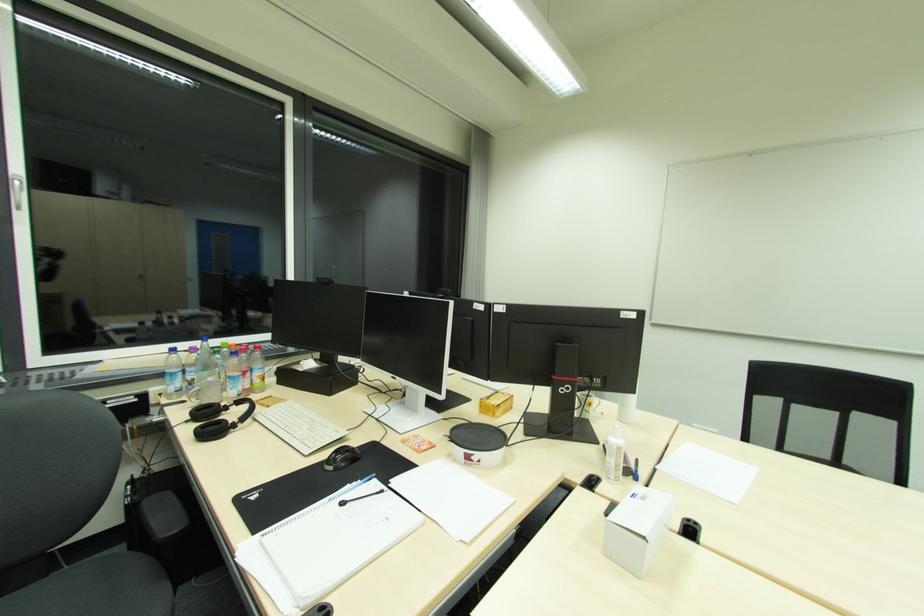
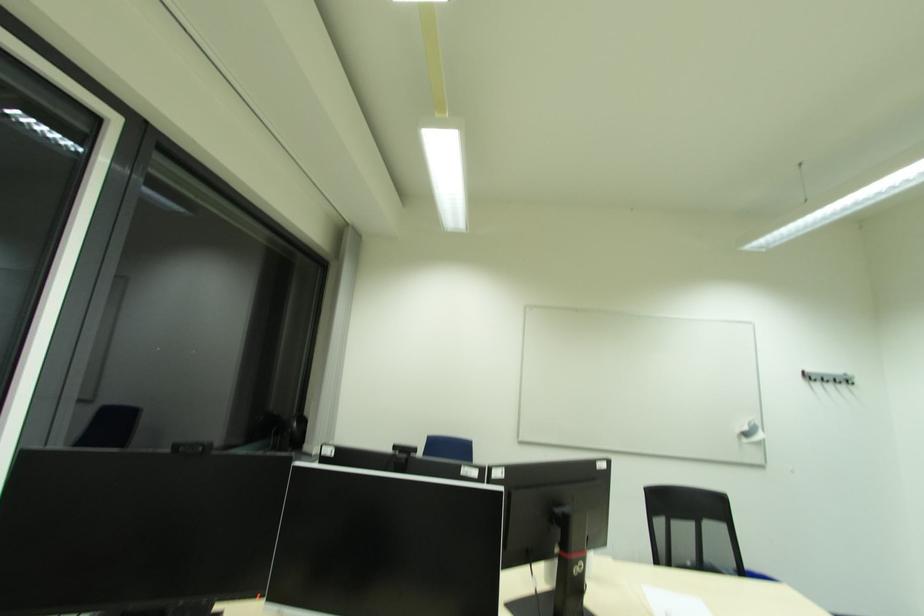
Question: How did the camera likely rotate?

Choices:
 (A) Left
 (B) Right
 (C) Up
 (D) Down

Answer: (B)